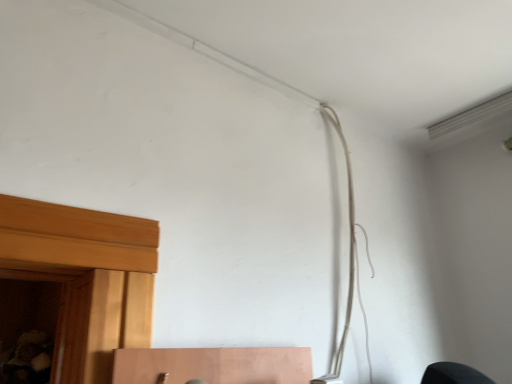
Identify the location of black matte speaker at lower right. (453, 374).

In order to face black matte speaker at lower right, should I rotate leftwards or rightwards?

Rotate right and turn 26.314 degrees.

What is the approximate width of black matte speaker at lower right?

black matte speaker at lower right is 8.18 inches wide.

Describe the element at coordinates (453, 374) in the screenshot. I see `black matte speaker at lower right` at that location.

Where is `black matte speaker at lower right`? The height and width of the screenshot is (384, 512). black matte speaker at lower right is located at coordinates (453, 374).